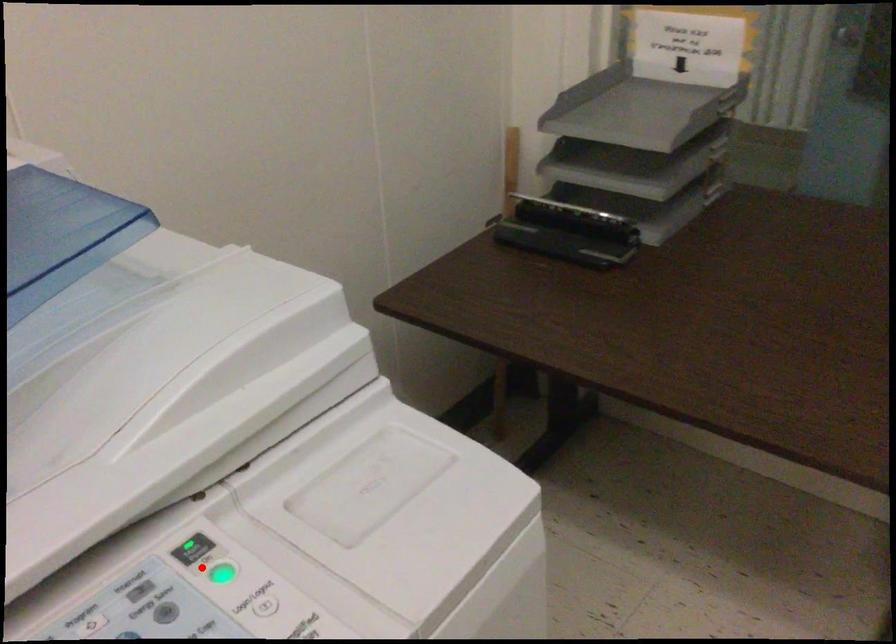
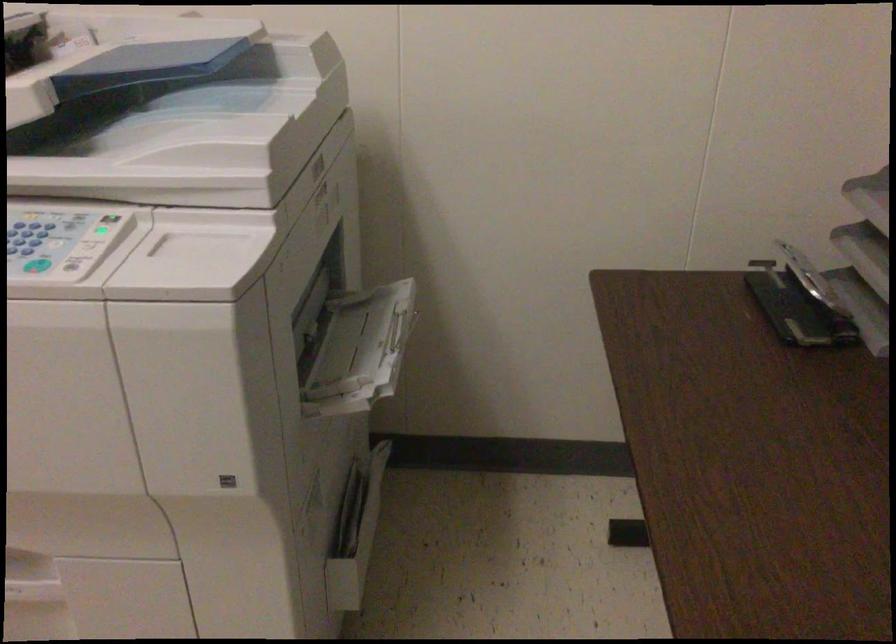
In the second image, find the point that corresponds to the highlighted location in the first image.

(107, 228)